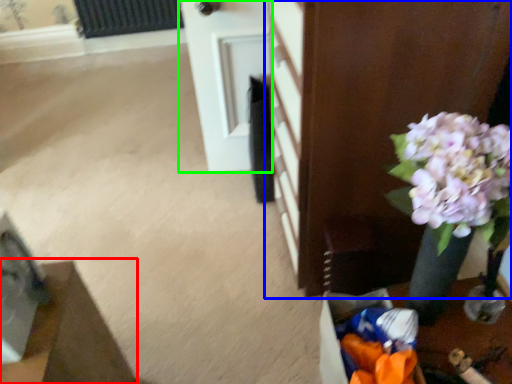
Question: Which is farther away from furniture (highlighted by a red box)? furniture (highlighted by a blue box) or door (highlighted by a green box)?

Choices:
 (A) furniture
 (B) door

Answer: (B)